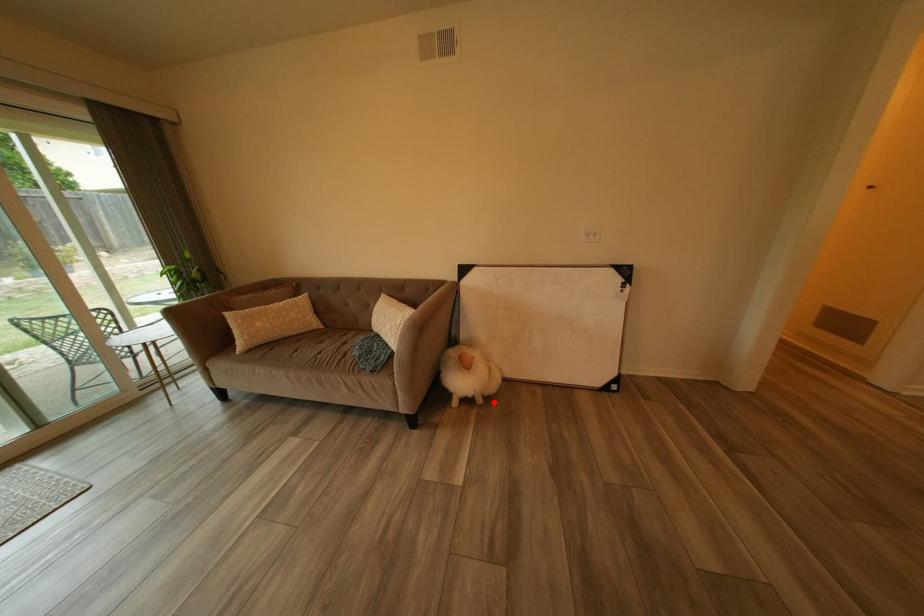
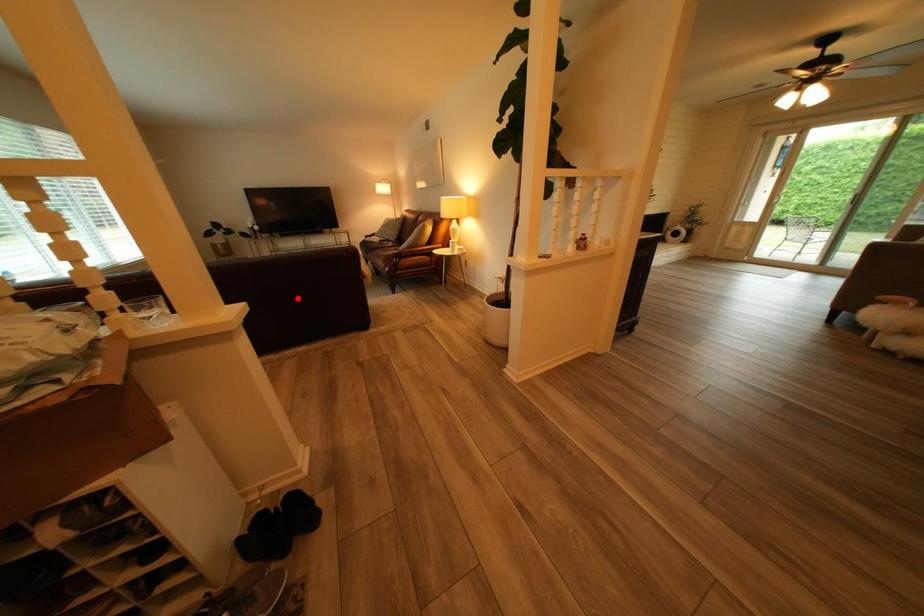
I am providing you with two images of the same scene from different viewpoints. A red point is marked on the first image and another point is marked on the second image. Is the marked point in image1 the same physical position as the marked point in image2?

No